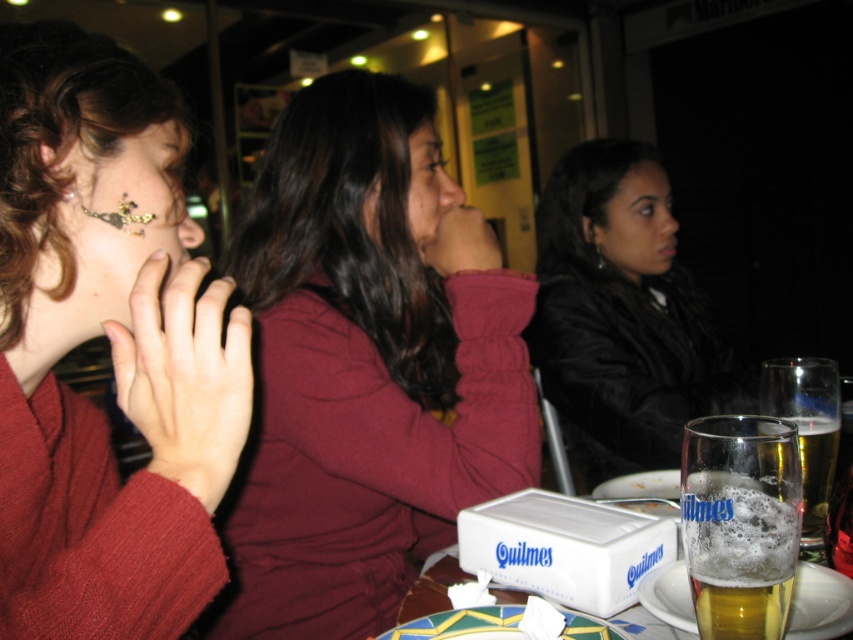
Is white cardboard box at lower center closer to camera compared to foamy golden beer at lower right?

Yes, white cardboard box at lower center is in front of foamy golden beer at lower right.

Can you confirm if white cardboard box at lower center is positioned below foamy golden beer at lower right?

Correct, white cardboard box at lower center is located below foamy golden beer at lower right.

The height and width of the screenshot is (640, 853). Identify the location of white cardboard box at lower center. (558, 545).

Locate an element on the screen. The height and width of the screenshot is (640, 853). white cardboard box at lower center is located at coordinates (558, 545).

Based on the photo, who is shorter, foamy golden beer at table right or foamy golden beer at lower right?

Standing shorter between the two is foamy golden beer at table right.

Is point (772, 515) in front of point (821, 520)?

Yes.

Between point (761, 547) and point (804, 432), which one is positioned behind?

Point (804, 432)

Where is `foamy golden beer at table right`? The height and width of the screenshot is (640, 853). foamy golden beer at table right is located at coordinates (738, 554).

Is matte maroon sweater at center further to camera compared to foamy golden beer at table right?

Yes, matte maroon sweater at center is behind foamy golden beer at table right.

Does matte maroon sweater at center appear on the right side of foamy golden beer at table right?

Incorrect, matte maroon sweater at center is not on the right side of foamy golden beer at table right.

What do you see at coordinates (363, 371) in the screenshot?
I see `matte maroon sweater at center` at bounding box center [363, 371].

The height and width of the screenshot is (640, 853). Find the location of `matte maroon sweater at center`. matte maroon sweater at center is located at coordinates (363, 371).